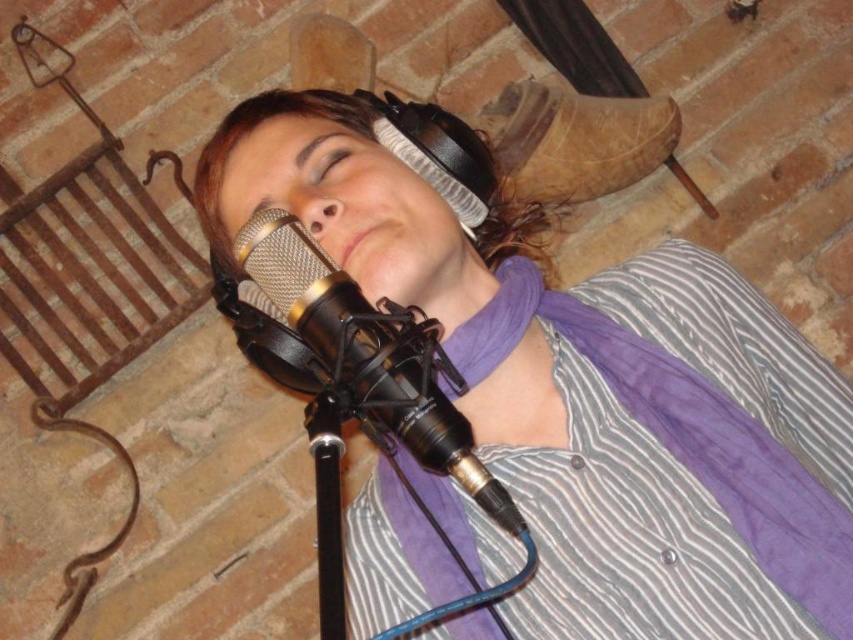
You are setting up a recording studio and need to place a new microphone stand. The existing microphone is already placed at point (589, 392) where the matte black headphones at center are located. Is there enough space to place the new microphone stand next to the existing one without overlapping?

→ The point (589, 392) marks the location of the matte black headphones at center, so placing a new microphone stand next to the existing one at that location may not be feasible as the headphones are already occupying that space. Consider repositioning the existing microphone or choosing an alternative area for the new stand.

You are setting up a recording studio and need to ensure that the matte black headphones at center and the black metallic microphone at center are properly arranged. According to the image, which object is placed above the other?

The matte black headphones at center is positioned over the black metallic microphone at center.